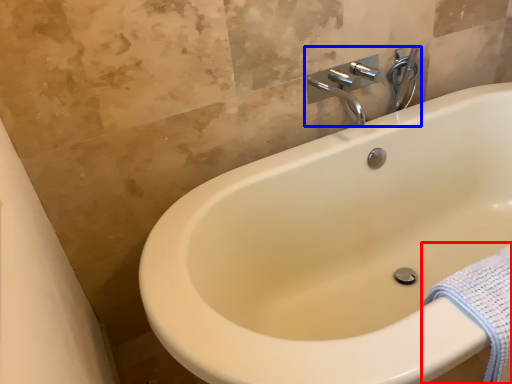
Question: Which object is closer to the camera taking this photo, bath towel (highlighted by a red box) or tap (highlighted by a blue box)?

Choices:
 (A) bath towel
 (B) tap

Answer: (A)